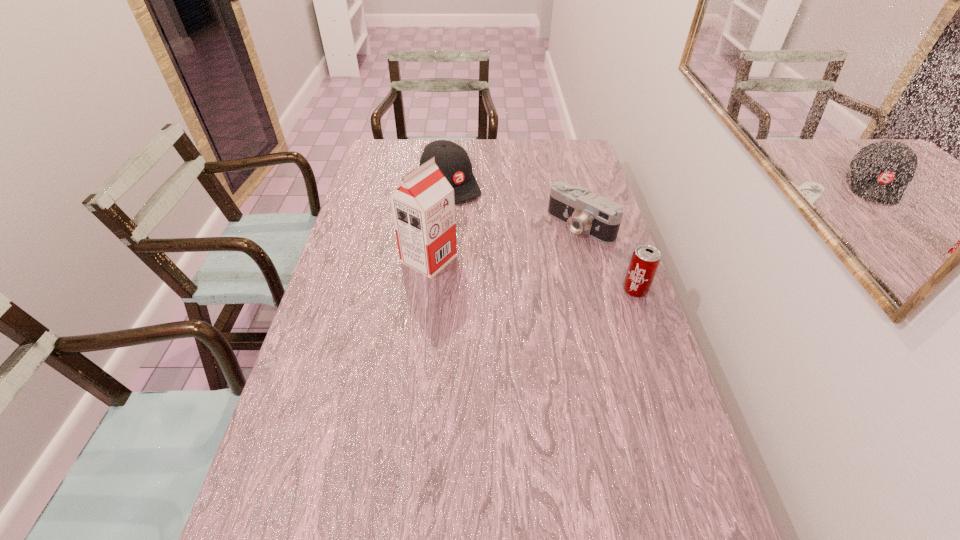
This screenshot has height=540, width=960. Identify the location of vacant space located on the lens of the shortest object. (482, 305).

Locate an element on the screen. vacant point located 0.050m on the lens of the shortest object is located at coordinates coord(554,247).

This screenshot has width=960, height=540. Find the location of `object positioned at the far edge`. object positioned at the far edge is located at coordinates (452, 159).

This screenshot has width=960, height=540. In order to click on beer can that is at the right edge in this screenshot , I will do [645, 260].

Image resolution: width=960 pixels, height=540 pixels. I want to click on camera at the right edge, so click(x=598, y=217).

Where is `blank space at the far edge`? blank space at the far edge is located at coordinates (503, 147).

Identify the location of vacant area at the near edge. (600, 510).

The image size is (960, 540). I want to click on vacant area at the left edge, so click(x=335, y=347).

Identify the location of vacant region at the right edge. pos(615,266).

I want to click on vacant space that's between the camera and the baseball cap, so click(x=516, y=205).